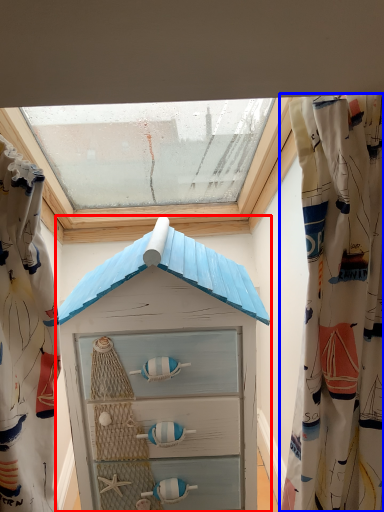
Question: Which object appears farthest to the camera in this image, beach hut (highlighted by a red box) or curtain (highlighted by a blue box)?

Choices:
 (A) beach hut
 (B) curtain

Answer: (A)